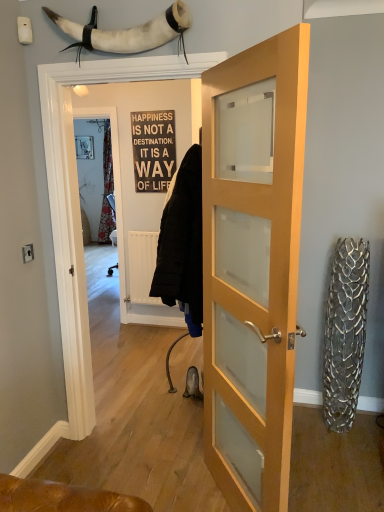
Question: Considering the relative sizes of white leather horn at upper center and wooden door at center, arranged as the 1th door when viewed from the left, in the image provided, is white leather horn at upper center shorter than wooden door at center, arranged as the 1th door when viewed from the left,?

Choices:
 (A) yes
 (B) no

Answer: (A)

Question: Is the surface of white leather horn at upper center in direct contact with wooden door at center, acting as the 2th door starting from the right?

Choices:
 (A) yes
 (B) no

Answer: (B)

Question: Would you consider white leather horn at upper center to be distant from wooden door at center, acting as the 2th door starting from the right?

Choices:
 (A) yes
 (B) no

Answer: (A)

Question: Is white leather horn at upper center facing away from wooden door at center, arranged as the 1th door when viewed from the left?

Choices:
 (A) no
 (B) yes

Answer: (A)

Question: Can you confirm if white leather horn at upper center is bigger than wooden door at center, arranged as the 1th door when viewed from the left?

Choices:
 (A) yes
 (B) no

Answer: (B)

Question: Is white leather horn at upper center in front of or behind white wood sign at center in the image?

Choices:
 (A) front
 (B) behind

Answer: (A)

Question: Based on their sizes in the image, would you say white leather horn at upper center is bigger or smaller than white wood sign at center?

Choices:
 (A) small
 (B) big

Answer: (B)

Question: Would you say white leather horn at upper center is to the left or to the right of white wood sign at center in the picture?

Choices:
 (A) right
 (B) left

Answer: (B)

Question: Is white leather horn at upper center inside the boundaries of white wood sign at center, or outside?

Choices:
 (A) inside
 (B) outside

Answer: (B)

Question: From their relative heights in the image, would you say white wood sign at center is taller or shorter than light wood/glass door at center, acting as the first door starting from the right?

Choices:
 (A) tall
 (B) short

Answer: (B)

Question: Is white wood sign at center inside the boundaries of light wood/glass door at center, acting as the 2th door starting from the left, or outside?

Choices:
 (A) inside
 (B) outside

Answer: (B)

Question: Considering the positions of point (165, 126) and point (279, 361), is point (165, 126) closer or farther from the camera than point (279, 361)?

Choices:
 (A) closer
 (B) farther

Answer: (B)

Question: From a real-world perspective, is white wood sign at center above or below light wood/glass door at center, acting as the first door starting from the right?

Choices:
 (A) below
 (B) above

Answer: (B)

Question: Relative to white wood sign at center, is light wood/glass door at center, acting as the first door starting from the right, in front or behind?

Choices:
 (A) front
 (B) behind

Answer: (A)

Question: From the image's perspective, relative to white wood sign at center, is light wood/glass door at center, acting as the 2th door starting from the left, above or below?

Choices:
 (A) below
 (B) above

Answer: (A)